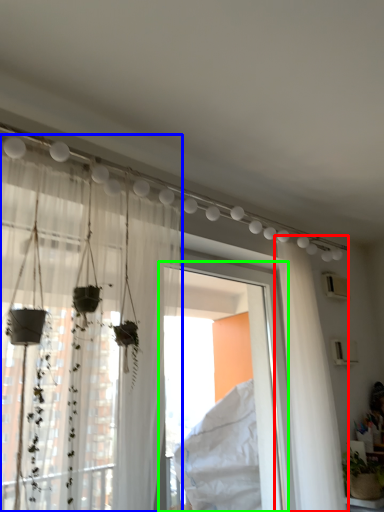
Question: Based on their relative distances, which object is nearer to curtain (highlighted by a red box)? Choose from curtain (highlighted by a blue box) and window frame (highlighted by a green box).

Choices:
 (A) curtain
 (B) window frame

Answer: (B)